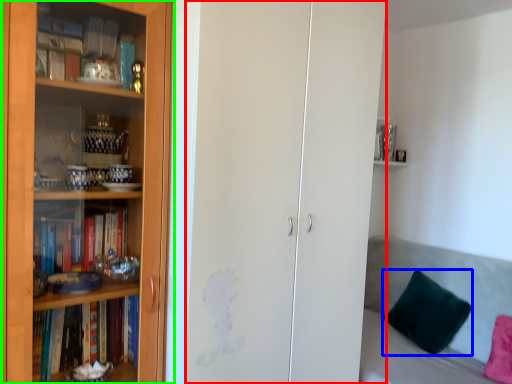
Question: Which object is the farthest from glass door (highlighted by a red box)? Choose among these: pillow (highlighted by a blue box) or bookcase (highlighted by a green box).

Choices:
 (A) pillow
 (B) bookcase

Answer: (A)